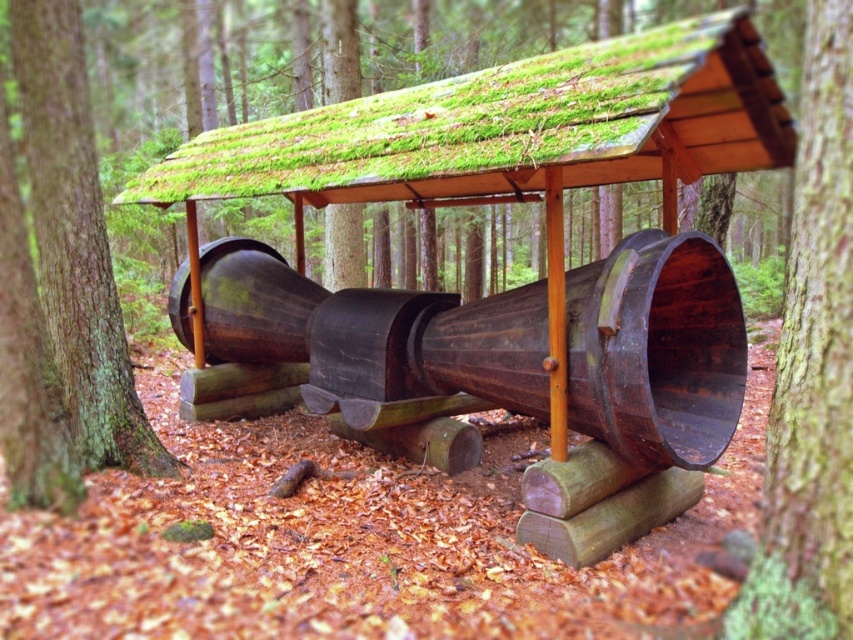
Question: Which object is closer to the camera taking this photo?

Choices:
 (A) brown wood tree trunk at left
 (B) green mossy bark at center
 (C) green mossy roof at center

Answer: (B)

Question: Which is farther from the green mossy bark at center?

Choices:
 (A) brown wood tree trunk at left
 (B) green mossy roof at center

Answer: (A)

Question: Is green mossy bark at center positioned in front of brown wood tree trunk at left?

Choices:
 (A) no
 (B) yes

Answer: (B)

Question: Is green mossy roof at center to the left of green mossy bark at center from the viewer's perspective?

Choices:
 (A) no
 (B) yes

Answer: (B)

Question: Which point appears farthest from the camera in this image?

Choices:
 (A) (x=741, y=596)
 (B) (x=38, y=99)
 (C) (x=677, y=97)

Answer: (C)

Question: Does green mossy bark at center lie in front of brown wood tree trunk at left?

Choices:
 (A) yes
 (B) no

Answer: (A)